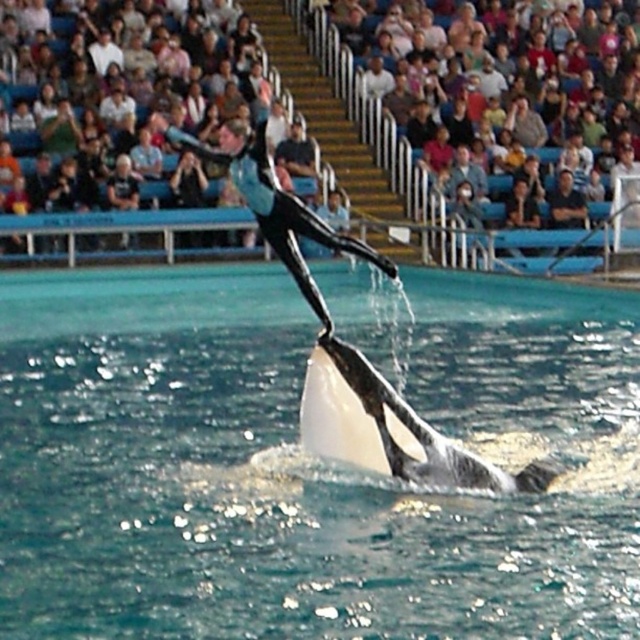
Which is below, clear blue water at center or black smooth whale at center?

black smooth whale at center is lower down.

This screenshot has height=640, width=640. Describe the element at coordinates (248, 486) in the screenshot. I see `clear blue water at center` at that location.

Where is `clear blue water at center`? The height and width of the screenshot is (640, 640). clear blue water at center is located at coordinates (248, 486).

Is multicolored fabric crowd at upper center behind black smooth whale at center?

Yes.

The width and height of the screenshot is (640, 640). Find the location of `multicolored fabric crowd at upper center`. multicolored fabric crowd at upper center is located at coordinates (316, 112).

Between clear blue water at center and multicolored fabric crowd at upper center, which one has more height?

multicolored fabric crowd at upper center is taller.

Which is behind, point (141, 544) or point (408, 44)?

The point (408, 44) is behind.

Locate an element on the screen. clear blue water at center is located at coordinates (248, 486).